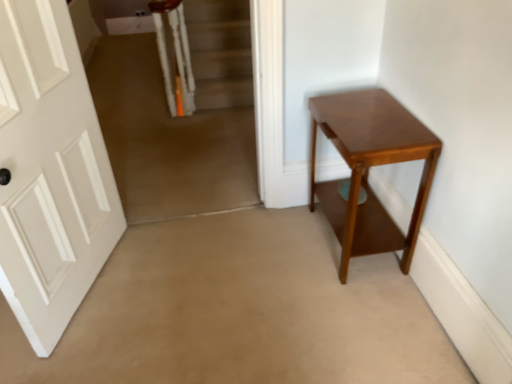
Where is `shiny brown table at right`? shiny brown table at right is located at coordinates (368, 169).

Which is closer, (334, 189) or (8, 12)?

The point (8, 12) is more forward.

At what (x,y) coordinates should I click in order to perform the action: click on table that appears below the white matte door at left (from the image's perspective). Please return your answer as a coordinate pair (x, y). The image size is (512, 384). Looking at the image, I should click on (368, 169).

From a real-world perspective, is shiny brown table at right positioned above or below white matte door at left?

shiny brown table at right is situated lower than white matte door at left in the real world.

Considering the relative sizes of shiny brown table at right and white matte door at left in the image provided, is shiny brown table at right thinner than white matte door at left?

Incorrect, the width of shiny brown table at right is not less than that of white matte door at left.

From a real-world perspective, is carpeted stairs at upper left located higher than white matte door at left?

Actually, carpeted stairs at upper left is physically below white matte door at left in the real world.

From the image's perspective, is carpeted stairs at upper left over white matte door at left?

Yes, from the image's perspective, carpeted stairs at upper left is above white matte door at left.

Considering the relative sizes of carpeted stairs at upper left and white matte door at left in the image provided, is carpeted stairs at upper left shorter than white matte door at left?

Correct, carpeted stairs at upper left is not as tall as white matte door at left.

Which point is more forward, (28, 22) or (246, 36)?

A: The point (28, 22) is closer.

How much distance is there between white matte door at left and carpeted stairs at upper left?

A distance of 38.43 inches exists between white matte door at left and carpeted stairs at upper left.

Does white matte door at left turn towards carpeted stairs at upper left?

No, white matte door at left is not oriented towards carpeted stairs at upper left.

Can we say carpeted stairs at upper left lies outside shiny brown table at right?

That's correct, carpeted stairs at upper left is outside of shiny brown table at right.

Which is closer to the camera, (x=159, y=189) or (x=352, y=180)?

Point (x=159, y=189) is positioned farther from the camera compared to point (x=352, y=180).

From the image's perspective, which is above, carpeted stairs at upper left or shiny brown table at right?

carpeted stairs at upper left appears higher in the image.

Considering the relative positions of carpeted stairs at upper left and shiny brown table at right in the image provided, is carpeted stairs at upper left behind shiny brown table at right?

Yes, carpeted stairs at upper left is further from the camera.

From a real-world perspective, is white matte door at left positioned above or below shiny brown table at right?

From a real-world perspective, white matte door at left is physically above shiny brown table at right.

Is white matte door at left aimed at shiny brown table at right?

Yes, white matte door at left is oriented towards shiny brown table at right.

Considering the relative sizes of shiny brown table at right and carpeted stairs at upper left in the image provided, is shiny brown table at right bigger than carpeted stairs at upper left?

Incorrect, shiny brown table at right is not larger than carpeted stairs at upper left.

Considering the relative positions of shiny brown table at right and carpeted stairs at upper left in the image provided, is shiny brown table at right to the left or to the right of carpeted stairs at upper left?

shiny brown table at right is positioned on carpeted stairs at upper left's right side.

From the image's perspective, between shiny brown table at right and carpeted stairs at upper left, which one is located above?

carpeted stairs at upper left appears higher in the image.

How many degrees apart are the facing directions of shiny brown table at right and carpeted stairs at upper left?

The angle between the facing direction of shiny brown table at right and the facing direction of carpeted stairs at upper left is 87.8 degrees.

Where is `door lying in front of the shiny brown table at right`? The width and height of the screenshot is (512, 384). door lying in front of the shiny brown table at right is located at coordinates (50, 172).

The width and height of the screenshot is (512, 384). In the image, there is a white matte door at left. Find the location of `corridor below it (from a real-world perspective)`. corridor below it (from a real-world perspective) is located at coordinates (180, 118).

Estimate the real-world distances between objects in this image. Which object is closer to carpeted stairs at upper left, shiny brown table at right or white matte door at left?

white matte door at left is closer to carpeted stairs at upper left.

When comparing their distances from white matte door at left, does shiny brown table at right or carpeted stairs at upper left seem closer?

carpeted stairs at upper left lies closer to white matte door at left than the other object.

Based on their spatial positions, is white matte door at left or shiny brown table at right further from carpeted stairs at upper left?

shiny brown table at right is positioned further to the anchor carpeted stairs at upper left.

Which object lies nearer to the anchor point shiny brown table at right, white matte door at left or carpeted stairs at upper left?

Among the two, carpeted stairs at upper left is located nearer to shiny brown table at right.

Based on their spatial positions, is carpeted stairs at upper left or shiny brown table at right further from white matte door at left?

shiny brown table at right.

Considering their positions, is carpeted stairs at upper left positioned closer to shiny brown table at right than white matte door at left?

carpeted stairs at upper left is closer to shiny brown table at right.

Locate an element on the screen. corridor between white matte door at left and shiny brown table at right in the horizontal direction is located at coordinates (180, 118).